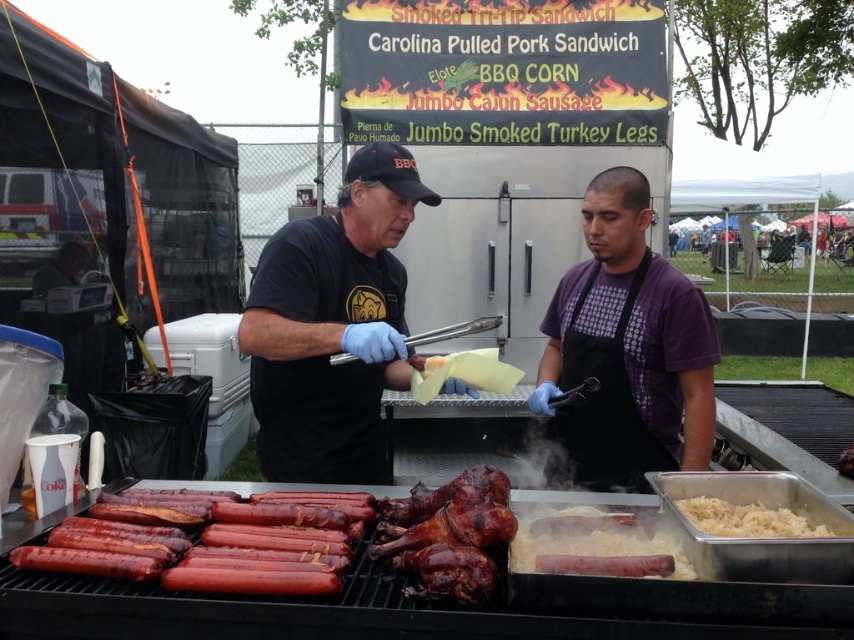
Question: In this image, where is black matte shirt at center located relative to shiny brown meat at center?

Choices:
 (A) right
 (B) left

Answer: (B)

Question: Among these objects, which one is nearest to the camera?

Choices:
 (A) white shredded cabbage at lower right
 (B) charred glossy hot dogs at center
 (C) shiny brown meat at center
 (D) purple dotted apron at center

Answer: (A)

Question: Which point is farther to the camera?

Choices:
 (A) (79, 544)
 (B) (689, 497)

Answer: (B)

Question: Which object is farther from the camera taking this photo?

Choices:
 (A) shiny brown meat at center
 (B) smokey brown sausage at center
 (C) black matte shirt at center

Answer: (C)

Question: Can you confirm if purple dotted apron at center is bigger than white shredded cabbage at lower right?

Choices:
 (A) yes
 (B) no

Answer: (A)

Question: Is charred glossy hot dogs at center above smokey brown sausage at center?

Choices:
 (A) no
 (B) yes

Answer: (A)